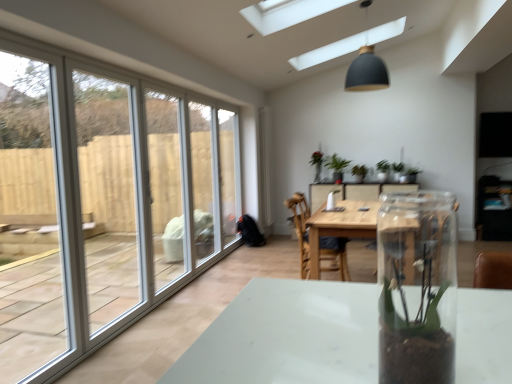
Question: In terms of width, does wooden table at center look wider or thinner when compared to clear glass vase at center?

Choices:
 (A) wide
 (B) thin

Answer: (A)

Question: Is wooden table at center bigger or smaller than clear glass vase at center?

Choices:
 (A) small
 (B) big

Answer: (B)

Question: Considering the real-world distances, which object is closest to the wooden table at center?

Choices:
 (A) green leafy plant at upper center, acting as the 2th houseplant starting from the left
 (B) white plastic window frame at left
 (C) wooden chair at center
 (D) clear glass vase at center
 (E) clear glass screen door at left, marked as the first screen door in a back-to-front arrangement

Answer: (C)

Question: Based on their relative distances, which object is farther from the white plastic window frame at left?

Choices:
 (A) clear glass screen door at left, marked as the first screen door in a back-to-front arrangement
 (B) wooden table at center
 (C) white plastic screen door at left, placed as the 1th screen door when sorted from front to back
 (D) green matte plant at center, which appears as the first houseplant when viewed from the left
 (E) wooden chair at center

Answer: (D)